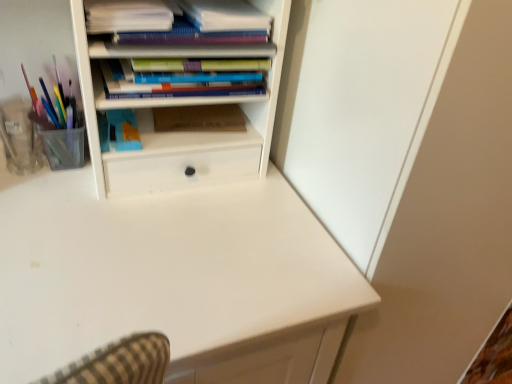
Question: Is matte purple notebook at upper center, the 2th book positioned from the top, shorter than blue matte paperback book at center, the 1th paperback book viewed from the left?

Choices:
 (A) no
 (B) yes

Answer: (B)

Question: Does matte purple notebook at upper center, positioned as the 2th book in bottom-to-top order, have a lesser width compared to blue matte paperback book at center, placed as the 2th paperback book when sorted from right to left?

Choices:
 (A) yes
 (B) no

Answer: (B)

Question: From the image's perspective, does matte purple notebook at upper center, positioned as the 2th book in bottom-to-top order, appear higher than blue matte paperback book at center, the 1th paperback book viewed from the left?

Choices:
 (A) no
 (B) yes

Answer: (B)

Question: Are matte purple notebook at upper center, positioned as the 2th book in bottom-to-top order, and blue matte paperback book at center, placed as the 2th paperback book when sorted from right to left, far apart?

Choices:
 (A) yes
 (B) no

Answer: (B)

Question: Can you confirm if matte purple notebook at upper center, the 2th book positioned from the top, is smaller than blue matte paperback book at center, placed as the 2th paperback book when sorted from right to left?

Choices:
 (A) yes
 (B) no

Answer: (B)

Question: Considering the positions of white paper stack at upper left, the third book positioned from the bottom, and matte purple notebook at upper center, the 2th book positioned from the top, in the image, is white paper stack at upper left, the third book positioned from the bottom, taller or shorter than matte purple notebook at upper center, the 2th book positioned from the top,?

Choices:
 (A) short
 (B) tall

Answer: (B)

Question: Considering the positions of white paper stack at upper left, acting as the first book starting from the top, and matte purple notebook at upper center, positioned as the 2th book in bottom-to-top order, in the image, is white paper stack at upper left, acting as the first book starting from the top, bigger or smaller than matte purple notebook at upper center, positioned as the 2th book in bottom-to-top order,?

Choices:
 (A) big
 (B) small

Answer: (B)

Question: Is white paper stack at upper left, the third book positioned from the bottom, to the left or to the right of matte purple notebook at upper center, positioned as the 2th book in bottom-to-top order, in the image?

Choices:
 (A) left
 (B) right

Answer: (A)

Question: Is white paper stack at upper left, acting as the first book starting from the top, wider or thinner than matte purple notebook at upper center, the 2th book positioned from the top?

Choices:
 (A) thin
 (B) wide

Answer: (B)

Question: From a real-world perspective, relative to brown cardboard at center, the 1th paperback book viewed from the right, is white paper stack at upper left, acting as the first book starting from the top, vertically above or below?

Choices:
 (A) below
 (B) above

Answer: (B)

Question: Is white paper stack at upper left, the third book positioned from the bottom, bigger or smaller than brown cardboard at center, the 1th paperback book viewed from the right?

Choices:
 (A) small
 (B) big

Answer: (B)

Question: In the image, is white paper stack at upper left, acting as the first book starting from the top, on the left side or the right side of brown cardboard at center, the 1th paperback book viewed from the right?

Choices:
 (A) right
 (B) left

Answer: (B)

Question: Is white paper stack at upper left, the third book positioned from the bottom, inside the boundaries of brown cardboard at center, placed as the 2th paperback book when sorted from left to right, or outside?

Choices:
 (A) inside
 (B) outside

Answer: (B)

Question: From the image's perspective, relative to blue matte paperback book at center, the 1th paperback book viewed from the left, is matte purple notebook at upper center, the 2th book positioned from the top, above or below?

Choices:
 (A) above
 (B) below

Answer: (A)

Question: In terms of height, does matte purple notebook at upper center, positioned as the 2th book in bottom-to-top order, look taller or shorter compared to blue matte paperback book at center, placed as the 2th paperback book when sorted from right to left?

Choices:
 (A) short
 (B) tall

Answer: (A)